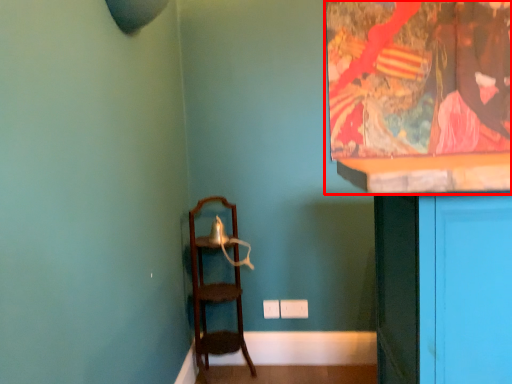
Question: From the image's perspective, where is picture frame (annotated by the red box) located relative to furniture?

Choices:
 (A) below
 (B) above

Answer: (B)